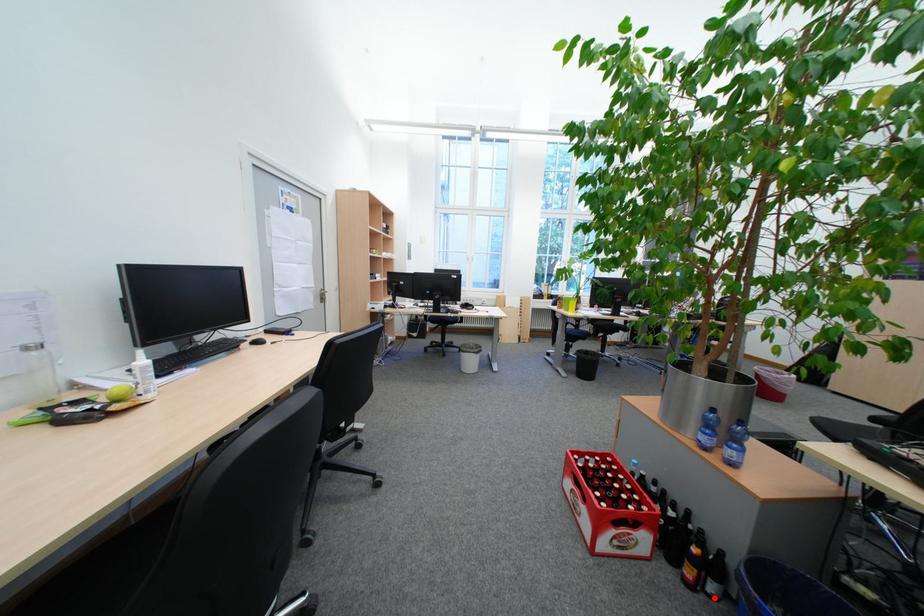
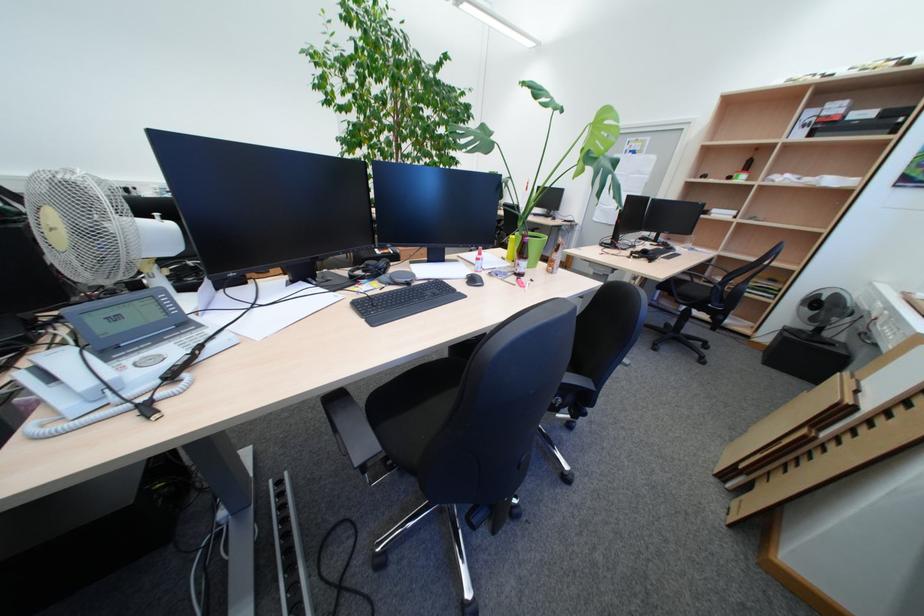
Question: I am providing you with two images of the same scene from different viewpoints. A red point is marked on the first image. Can you still see the location of the red point in image 2?

Choices:
 (A) Yes
 (B) No

Answer: (B)